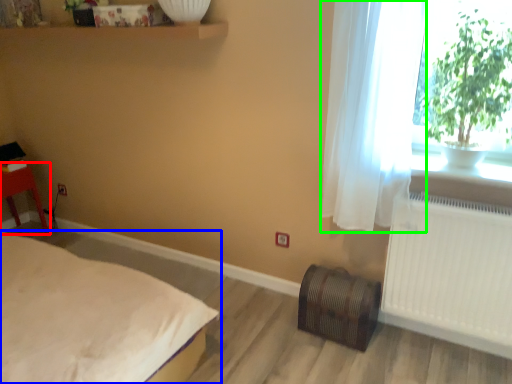
Question: Considering the real-world distances, which object is closest to furniture (highlighted by a red box)? bed (highlighted by a blue box) or curtain (highlighted by a green box).

Choices:
 (A) bed
 (B) curtain

Answer: (A)